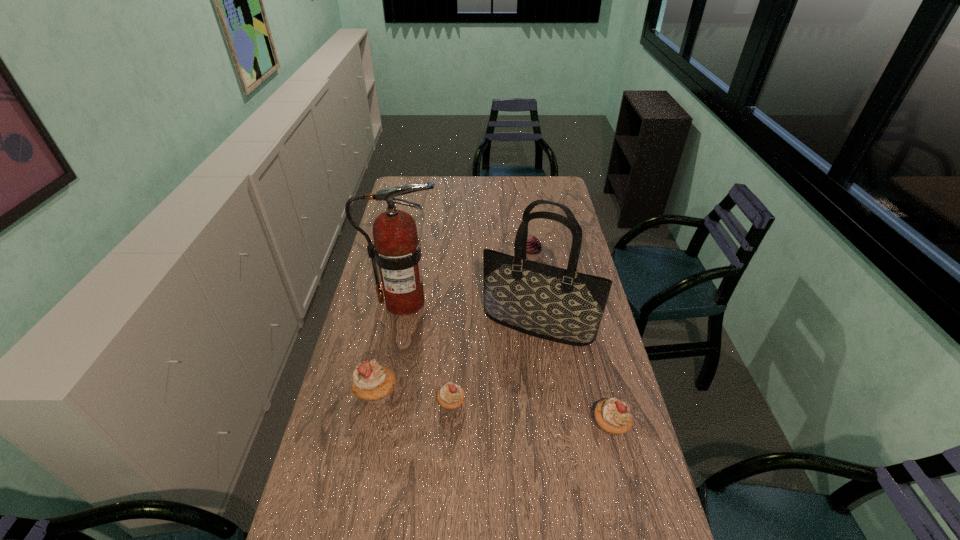
Locate an element on the screen. free location that satisfies the following two spatial constraints: 1. on the front side of the rightmost cupcake; 2. on the left side of the second cupcake from left to right is located at coordinates (450, 425).

Locate an element on the screen. The image size is (960, 540). vacant space that satisfies the following two spatial constraints: 1. on the back side of the rightmost cupcake; 2. at the nozzle of the fire extinguisher is located at coordinates (580, 302).

At what (x,y) coordinates should I click in order to perform the action: click on free space that satisfies the following two spatial constraints: 1. on the front side of the farthest object; 2. at the nozzle of the fire extinguisher. Please return your answer as a coordinate pair (x, y). Looking at the image, I should click on (538, 302).

I want to click on free space that satisfies the following two spatial constraints: 1. at the nozzle of the fire extinguisher; 2. on the back side of the rightmost cupcake, so click(x=382, y=425).